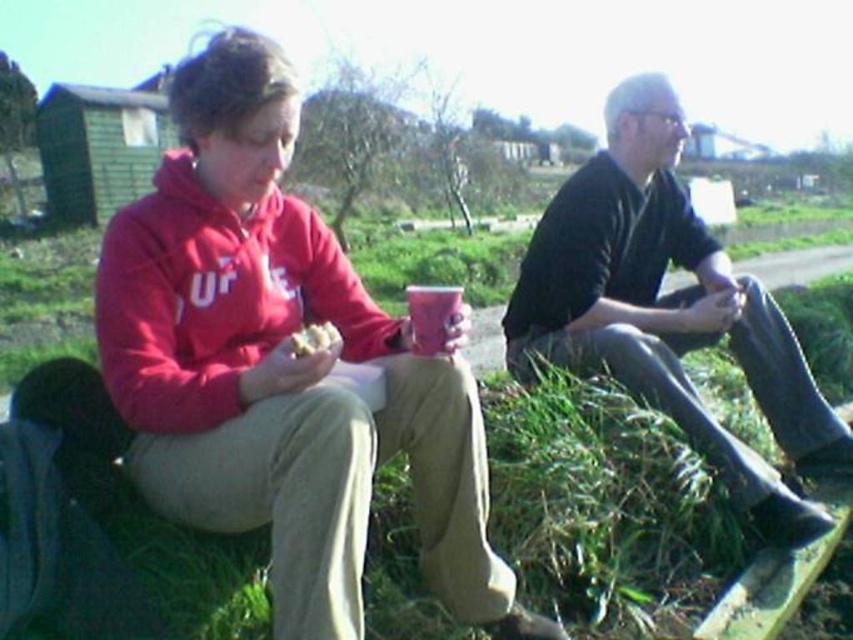
Question: Is rubber boots at right to the left of crumbly bread at center from the viewer's perspective?

Choices:
 (A) yes
 (B) no

Answer: (B)

Question: Among these objects, which one is farthest from the camera?

Choices:
 (A) matte plastic cup at center
 (B) rubber boots at right
 (C) crumbly bread at center

Answer: (B)

Question: Is matte plastic cup at center closer to the viewer compared to crumbly bread at center?

Choices:
 (A) no
 (B) yes

Answer: (A)

Question: Which is farther from the rubber boots at right?

Choices:
 (A) matte plastic cup at center
 (B) crumbly bread at center

Answer: (B)

Question: Is rubber boots at right smaller than matte plastic cup at center?

Choices:
 (A) no
 (B) yes

Answer: (A)

Question: Which of the following is the farthest from the observer?

Choices:
 (A) [430, 317]
 (B) [325, 340]
 (C) [659, 362]

Answer: (C)